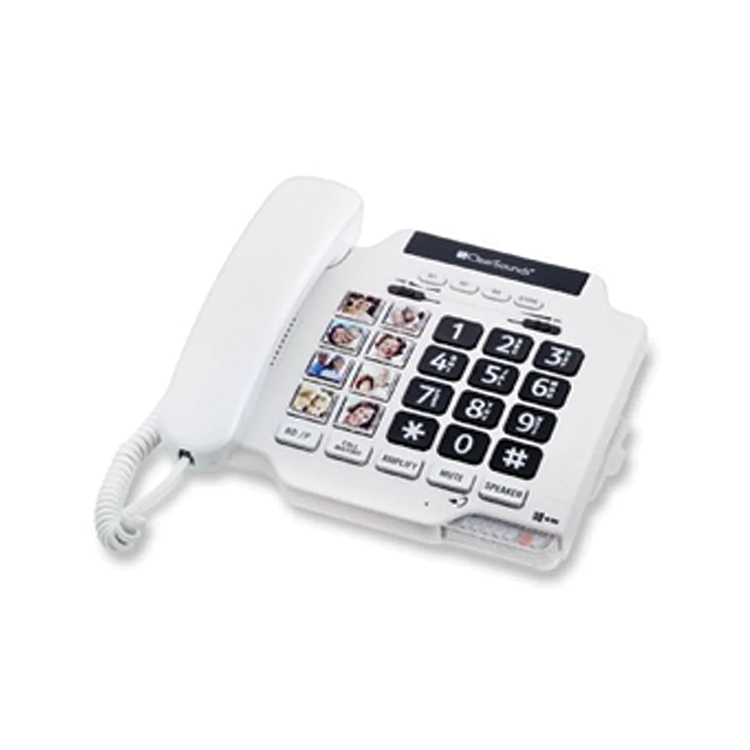
Identify the location of speaker button. Image resolution: width=750 pixels, height=750 pixels. (501, 495).